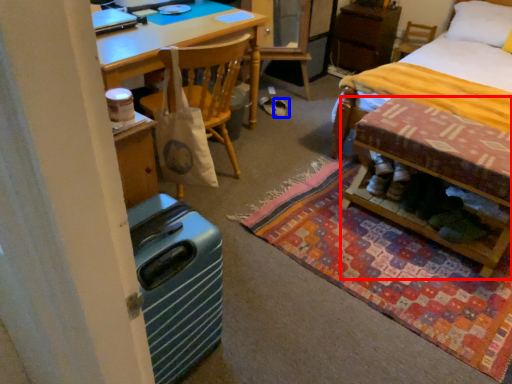
Question: Which of the following is the farthest to the observer, table (highlighted by a red box) or footwear (highlighted by a blue box)?

Choices:
 (A) table
 (B) footwear

Answer: (B)